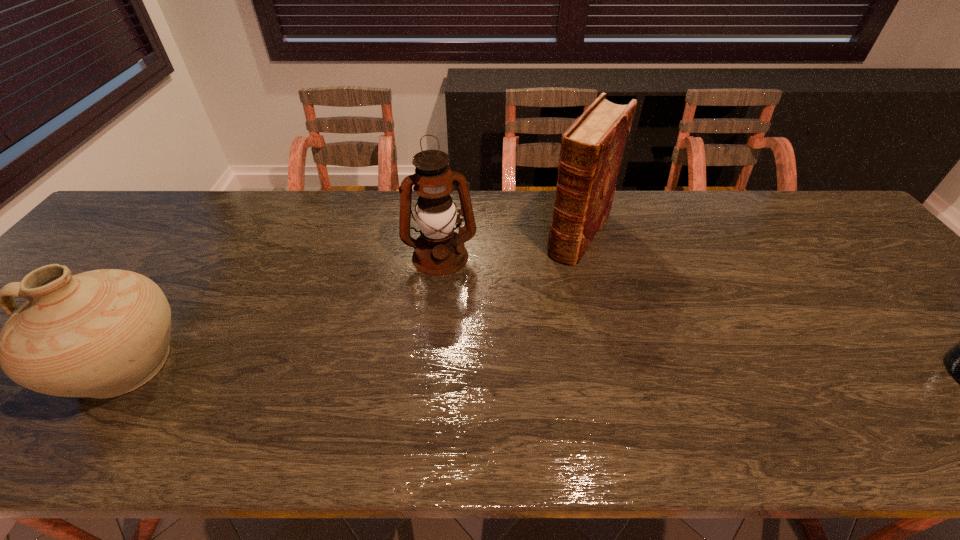
Where is `free space between the hardback book and the second object from left to right`? free space between the hardback book and the second object from left to right is located at coordinates (510, 245).

Where is `free point between the lantern and the hardback book`? free point between the lantern and the hardback book is located at coordinates (510, 245).

Locate an element on the screen. This screenshot has height=540, width=960. unoccupied position between the third object from right to left and the third object from left to right is located at coordinates (510, 245).

You are a GUI agent. You are given a task and a screenshot of the screen. Output one action in this format:
    pyautogui.click(x=<x>, y=<y>)
    Task: Click on the vacant region between the lantern and the second object from right to left
    
    Given the screenshot: What is the action you would take?
    pyautogui.click(x=510, y=245)

You are a GUI agent. You are given a task and a screenshot of the screen. Output one action in this format:
    pyautogui.click(x=<x>, y=<y>)
    Task: Click on the free space that is in between the leftmost object and the hardback book
    Image resolution: width=960 pixels, height=540 pixels.
    Given the screenshot: What is the action you would take?
    pyautogui.click(x=351, y=298)

The image size is (960, 540). I want to click on free area in between the pottery and the third object from right to left, so [282, 310].

Where is `the second closest object relative to the shortest object`? The width and height of the screenshot is (960, 540). the second closest object relative to the shortest object is located at coordinates (439, 251).

Find the location of a particular element. object that is the closest one to the second object from left to right is located at coordinates (592, 148).

You are a GUI agent. You are given a task and a screenshot of the screen. Output one action in this format:
    pyautogui.click(x=<x>, y=<y>)
    Task: Click on the vacant region that satisfies the following two spatial constraints: 1. on the back side of the lantern; 2. on the right side of the second shortest object
    The width and height of the screenshot is (960, 540).
    Given the screenshot: What is the action you would take?
    pyautogui.click(x=196, y=256)